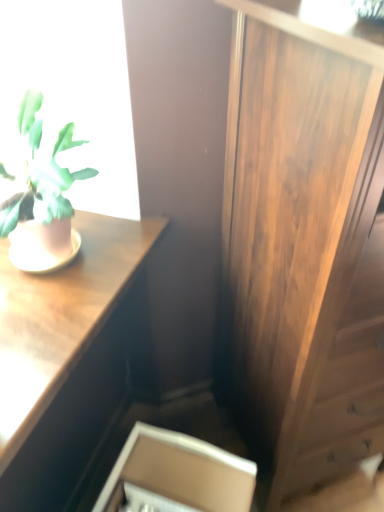
Question: From a real-world perspective, is matte pink pot at left located higher than wooden side cabinet at right?

Choices:
 (A) yes
 (B) no

Answer: (A)

Question: From the image's perspective, is matte pink pot at left above wooden side cabinet at right?

Choices:
 (A) yes
 (B) no

Answer: (A)

Question: Does matte pink pot at left appear on the left side of wooden side cabinet at right?

Choices:
 (A) yes
 (B) no

Answer: (A)

Question: Considering the relative sizes of matte pink pot at left and wooden side cabinet at right in the image provided, is matte pink pot at left thinner than wooden side cabinet at right?

Choices:
 (A) yes
 (B) no

Answer: (A)

Question: From a real-world perspective, is matte pink pot at left beneath wooden side cabinet at right?

Choices:
 (A) yes
 (B) no

Answer: (B)

Question: Is wooden desk at upper left wider or thinner than white cardboard box at lower center?

Choices:
 (A) wide
 (B) thin

Answer: (A)

Question: From a real-world perspective, is wooden desk at upper left positioned above or below white cardboard box at lower center?

Choices:
 (A) below
 (B) above

Answer: (B)

Question: Considering the positions of point (87, 422) and point (248, 470), is point (87, 422) closer or farther from the camera than point (248, 470)?

Choices:
 (A) farther
 (B) closer

Answer: (A)

Question: Considering the relative positions of wooden desk at upper left and white cardboard box at lower center in the image provided, is wooden desk at upper left to the left or to the right of white cardboard box at lower center?

Choices:
 (A) left
 (B) right

Answer: (A)

Question: Based on their sizes in the image, would you say wooden desk at upper left is bigger or smaller than matte pink pot at left?

Choices:
 (A) big
 (B) small

Answer: (A)

Question: From the image's perspective, relative to matte pink pot at left, is wooden desk at upper left above or below?

Choices:
 (A) below
 (B) above

Answer: (A)

Question: Is wooden desk at upper left inside the boundaries of matte pink pot at left, or outside?

Choices:
 (A) outside
 (B) inside

Answer: (A)

Question: Considering the positions of point (82, 322) and point (21, 247), is point (82, 322) closer or farther from the camera than point (21, 247)?

Choices:
 (A) closer
 (B) farther

Answer: (A)

Question: Would you say matte pink pot at left is to the left or to the right of wooden side cabinet at right in the picture?

Choices:
 (A) right
 (B) left

Answer: (B)

Question: Is matte pink pot at left in front of or behind wooden side cabinet at right in the image?

Choices:
 (A) behind
 (B) front

Answer: (A)